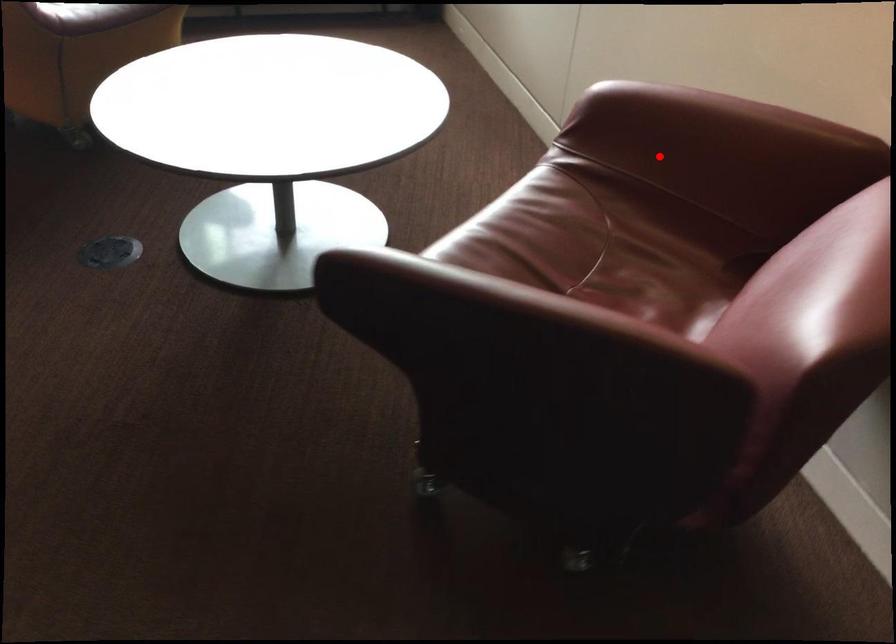
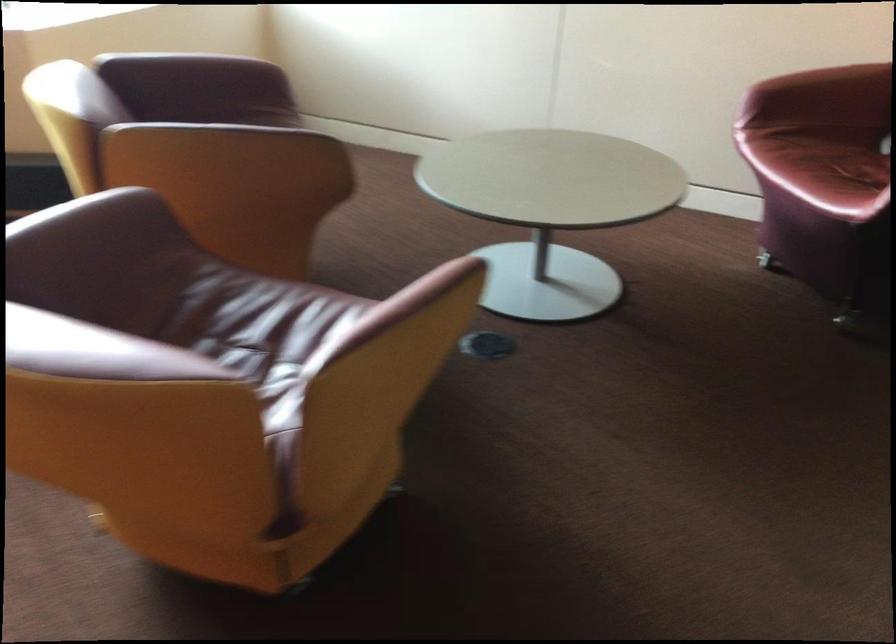
Question: I am providing you with two images of the same scene from different viewpoints. Given a red point in image1, look at the same physical point in image2. Is it:

Choices:
 (A) Closer to the viewpoint
 (B) Farther from the viewpoint

Answer: (B)